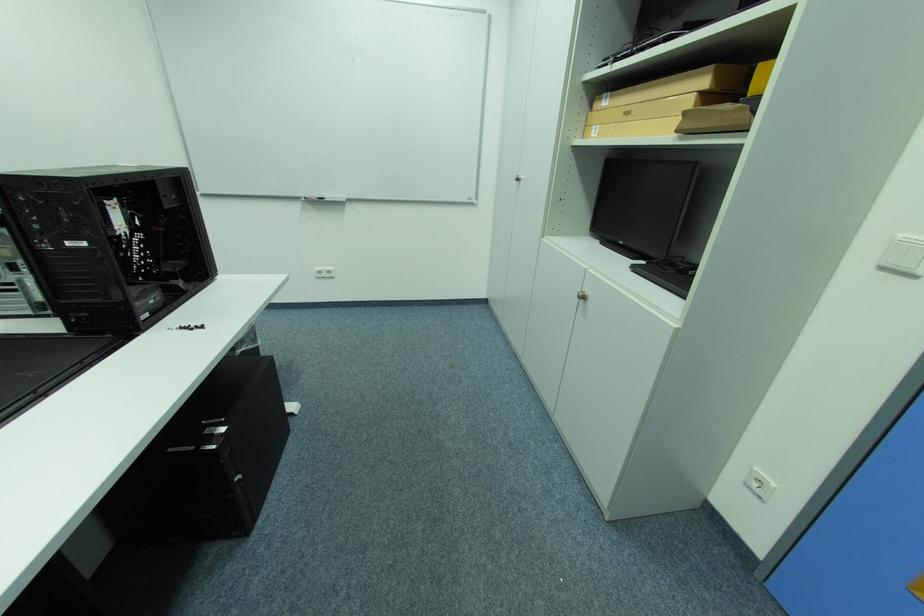
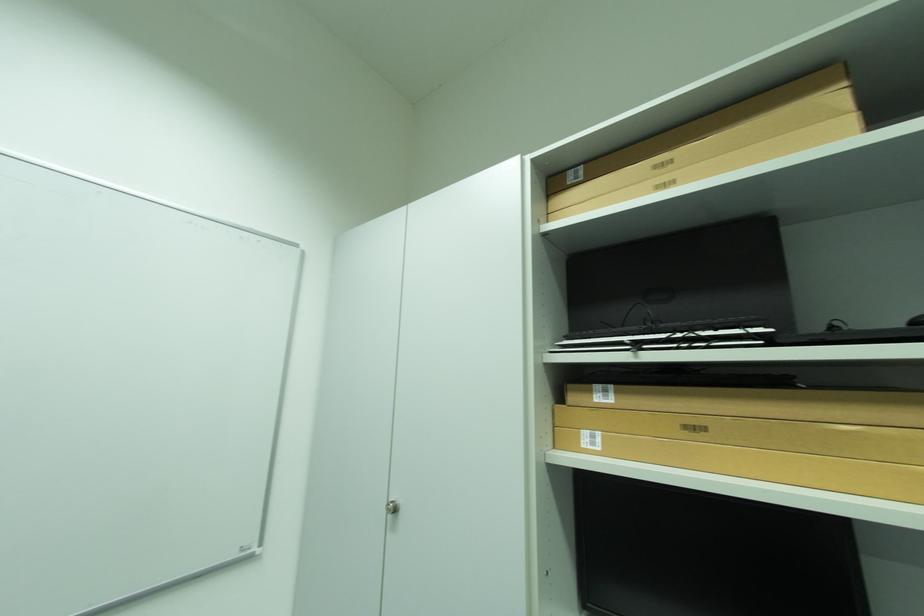
Find the pixel in the second image that matches [602,128] in the first image.

(593, 434)